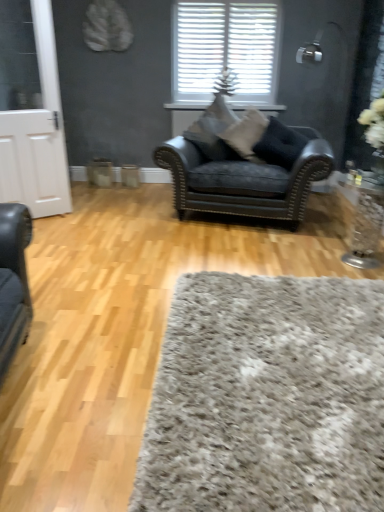
Question: Can you confirm if black leather pillow at center, placed as the 3th pillow when sorted from left to right, is thinner than suede-like gray pillow at center, which is counted as the third pillow, starting from the right?

Choices:
 (A) no
 (B) yes

Answer: (B)

Question: Is suede-like gray pillow at center, which is counted as the third pillow, starting from the right, completely or partially inside black leather pillow at center, the 1th pillow in the right-to-left sequence?

Choices:
 (A) yes
 (B) no

Answer: (B)

Question: Does black leather pillow at center, the 1th pillow in the right-to-left sequence, have a greater height compared to suede-like gray pillow at center, which is the 1th pillow in left-to-right order?

Choices:
 (A) yes
 (B) no

Answer: (B)

Question: From a real-world perspective, is black leather pillow at center, the 1th pillow in the right-to-left sequence, physically below suede-like gray pillow at center, which is counted as the third pillow, starting from the right?

Choices:
 (A) no
 (B) yes

Answer: (B)

Question: From the image's perspective, is black leather pillow at center, the 1th pillow in the right-to-left sequence, on suede-like gray pillow at center, which is the 1th pillow in left-to-right order?

Choices:
 (A) no
 (B) yes

Answer: (A)

Question: In the image, is velvet black armchair at center on the left side or the right side of clear glass vase at right?

Choices:
 (A) left
 (B) right

Answer: (A)

Question: In terms of width, does velvet black armchair at center look wider or thinner when compared to clear glass vase at right?

Choices:
 (A) wide
 (B) thin

Answer: (A)

Question: From a real-world perspective, relative to clear glass vase at right, is velvet black armchair at center vertically above or below?

Choices:
 (A) above
 (B) below

Answer: (A)

Question: Considering their positions, is velvet black armchair at center located in front of or behind clear glass vase at right?

Choices:
 (A) front
 (B) behind

Answer: (B)

Question: Is point (253, 156) closer or farther from the camera than point (168, 159)?

Choices:
 (A) farther
 (B) closer

Answer: (A)

Question: In terms of size, does suede-like beige pillow at center, marked as the 2th pillow in a right-to-left arrangement, appear bigger or smaller than velvet black armchair at center?

Choices:
 (A) small
 (B) big

Answer: (A)

Question: In terms of width, does suede-like beige pillow at center, marked as the 2th pillow in a right-to-left arrangement, look wider or thinner when compared to velvet black armchair at center?

Choices:
 (A) thin
 (B) wide

Answer: (A)

Question: Considering the positions of suede-like beige pillow at center, which ranks as the second pillow in left-to-right order, and velvet black armchair at center in the image, is suede-like beige pillow at center, which ranks as the second pillow in left-to-right order, taller or shorter than velvet black armchair at center?

Choices:
 (A) tall
 (B) short

Answer: (B)

Question: In terms of height, does black leather pillow at center, the 1th pillow in the right-to-left sequence, look taller or shorter compared to white textured blinds at upper center?

Choices:
 (A) short
 (B) tall

Answer: (A)

Question: In the image, is black leather pillow at center, the 1th pillow in the right-to-left sequence, on the left side or the right side of white textured blinds at upper center?

Choices:
 (A) right
 (B) left

Answer: (A)